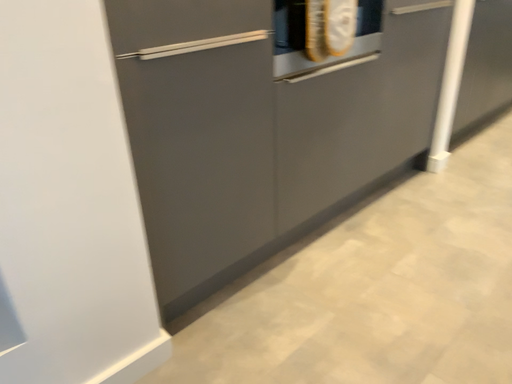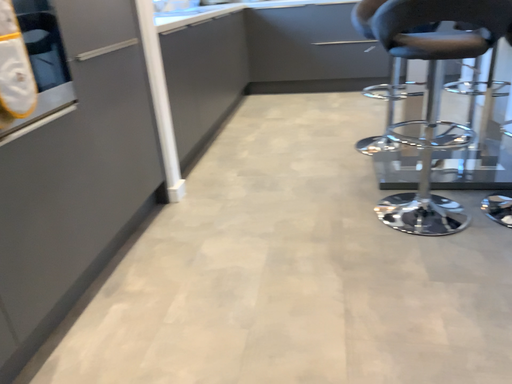
Question: Which way did the camera rotate in the video?

Choices:
 (A) rotated left
 (B) rotated right

Answer: (B)